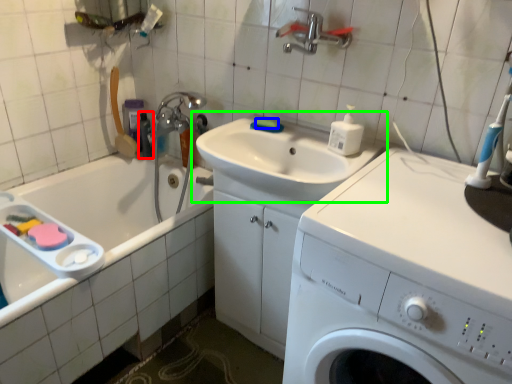
Question: Based on their relative distances, which object is nearer to toiletry (highlighted by a red box)? Choose from soap (highlighted by a blue box) and sink (highlighted by a green box).

Choices:
 (A) soap
 (B) sink

Answer: (A)